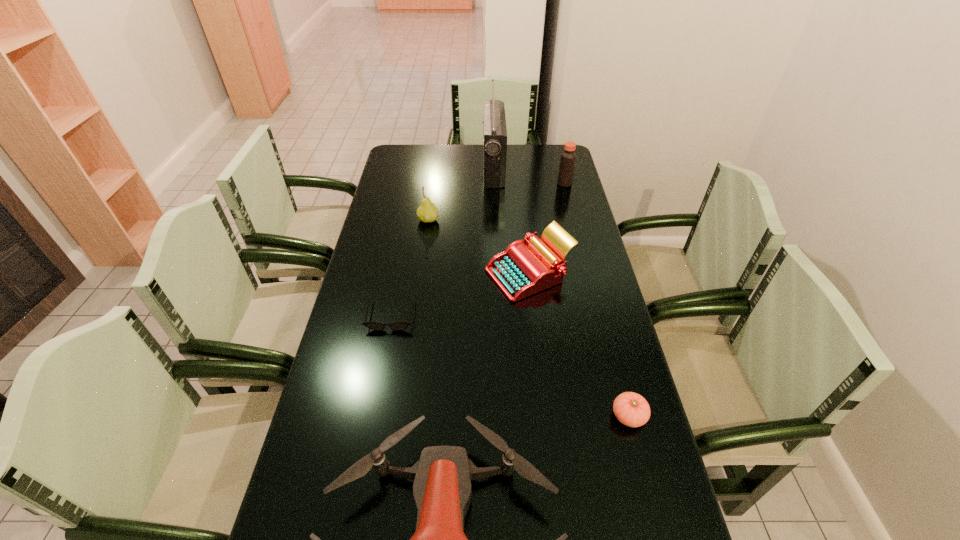
Locate an element on the screen. vacant space situated on the front of the second tallest object is located at coordinates (574, 220).

This screenshot has height=540, width=960. I want to click on vacant space located 0.050m on the front of the fifth nearest object, so click(x=426, y=235).

Identify the location of vacant space located on the typing side of the typewriter. Image resolution: width=960 pixels, height=540 pixels. (367, 274).

Where is `vacant area situated 0.350m on the typing side of the typewriter`? This screenshot has height=540, width=960. vacant area situated 0.350m on the typing side of the typewriter is located at coordinates (376, 274).

Where is `blank space located on the typing side of the typewriter`? The height and width of the screenshot is (540, 960). blank space located on the typing side of the typewriter is located at coordinates (432, 274).

Where is `vacant space situated on the left of the second nearest object`? Image resolution: width=960 pixels, height=540 pixels. vacant space situated on the left of the second nearest object is located at coordinates (445, 416).

This screenshot has height=540, width=960. In order to click on free point located on the front-facing side of the sunglasses in this screenshot , I will do `click(364, 455)`.

Image resolution: width=960 pixels, height=540 pixels. In order to click on object located in the far edge section of the desktop in this screenshot , I will do `click(495, 132)`.

Find the location of a particular element. Image resolution: width=960 pixels, height=540 pixels. object that is at the left edge is located at coordinates (397, 326).

Image resolution: width=960 pixels, height=540 pixels. Identify the location of vinegar that is at the right edge. (568, 157).